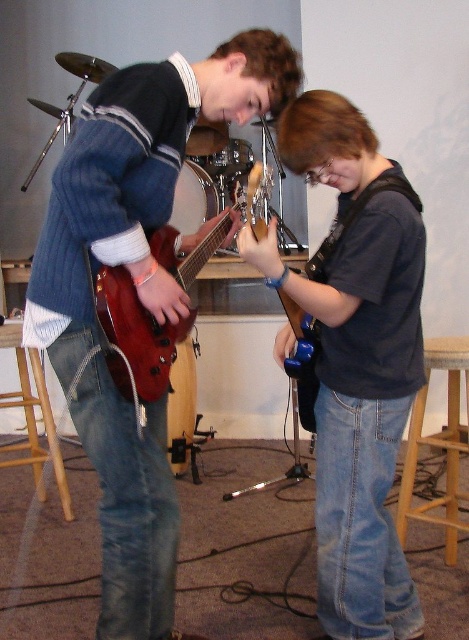
You are standing in the music studio and want to locate the blue glossy guitar at center. According to the coordinates provided, where should you look?

You should look at point (361,408) to find the blue glossy guitar at center.

You are a music teacher observing two students practicing with their guitars. You notice the matte black guitar at center and the glossy plastic guitar at center. Which guitar is taller?

The matte black guitar at center is much taller than the glossy plastic guitar at center.

You are setting up a music stand between the matte black guitar at center and the glossy plastic guitar at center. Which guitar should you place the stand closer to if you want it to be equidistant from both guitars?

The music stand should be placed closer to the glossy plastic guitar at center because the matte black guitar at center might be wider, so positioning the stand closer to the narrower glossy plastic guitar would help achieve equal distance between both guitars.